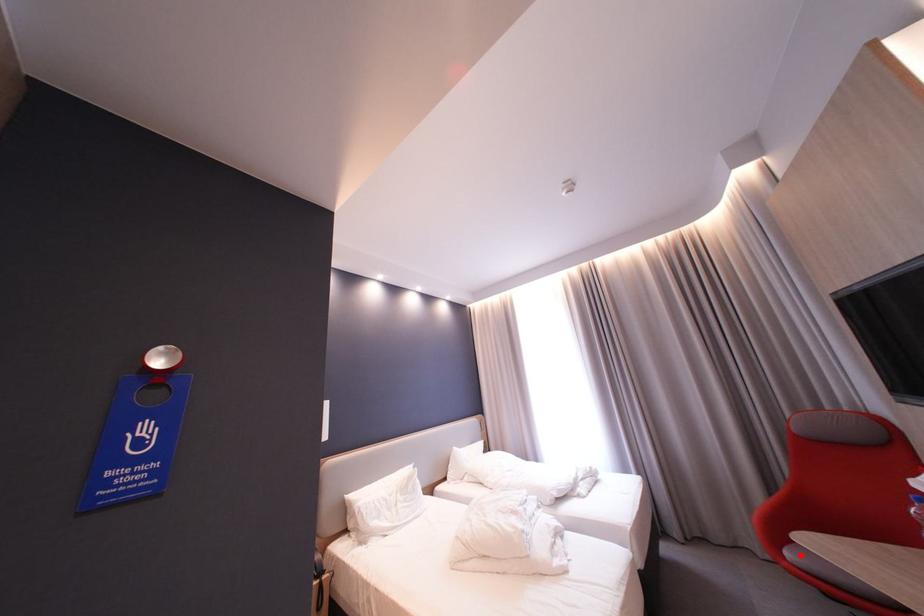
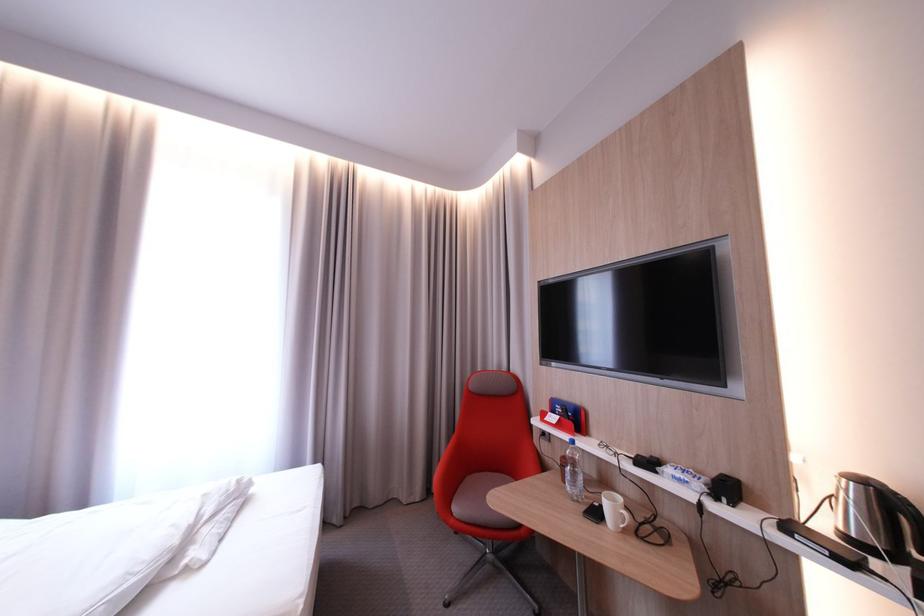
Question: I am providing you with two images of the same scene from different viewpoints. Given a red point in image1, look at the same physical point in image2. Is it:

Choices:
 (A) Closer to the viewpoint
 (B) Farther from the viewpoint

Answer: (B)